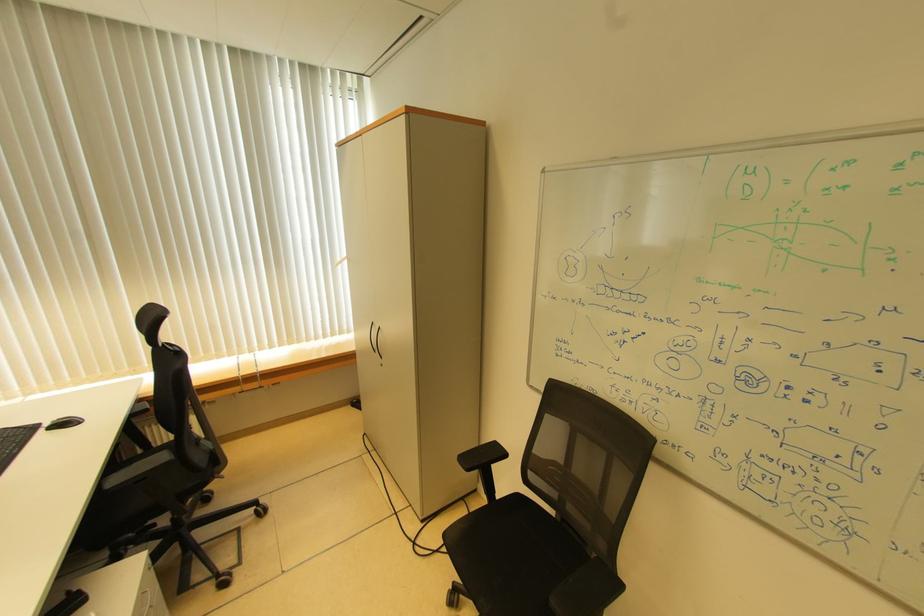
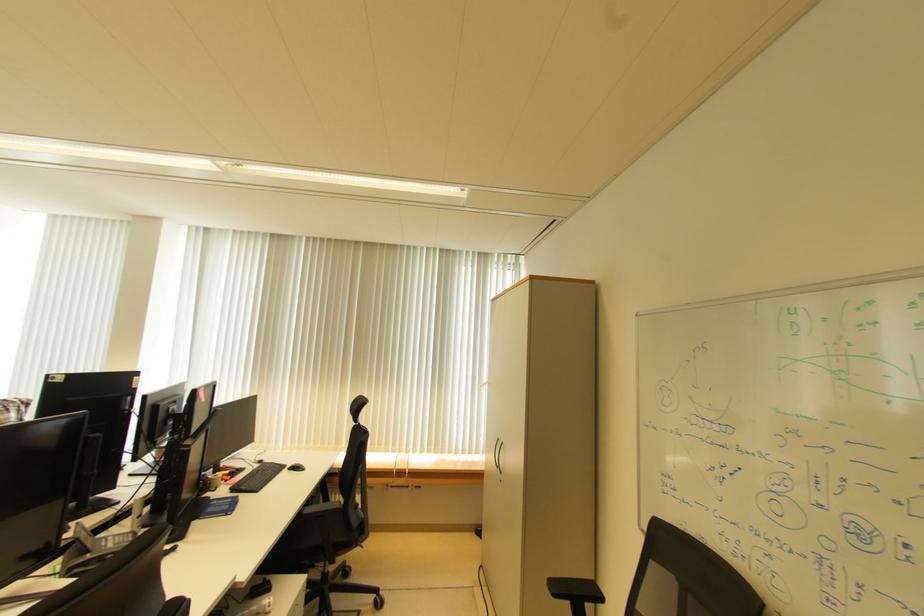
Find the pixel in the second image that matches point (126, 480) in the first image.

(319, 511)